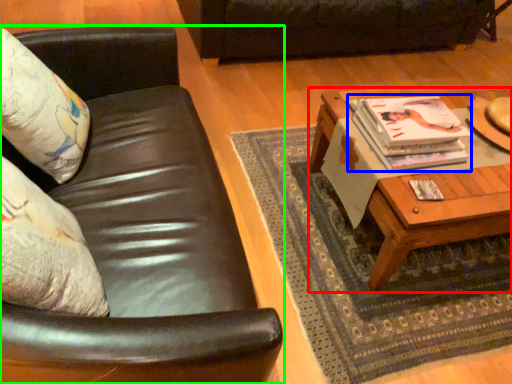
Question: Based on their relative distances, which object is nearer to coffee table (highlighted by a red box)? Choose from magazine (highlighted by a blue box) and studio couch (highlighted by a green box).

Choices:
 (A) magazine
 (B) studio couch

Answer: (A)